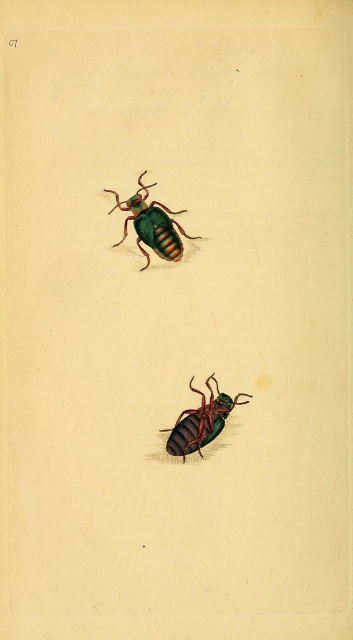
You are an entomologist examining the image of two beetles. You notice two specific points marked in the image. The first point is at coordinates point (123,202), and the second is at point (184,417). From your viewpoint, which point is closer to you?

Point (123,202) is in front of point (184,417), so it is closer to you.

You are an entomologist examining two beetles in the image. You need to determine which beetle is larger. The beetles are the green glossy beetle at center and the green matte beetle at lower center. Which one is larger?

The green glossy beetle at center is bigger than the green matte beetle at lower center, so the green glossy beetle at center is larger.